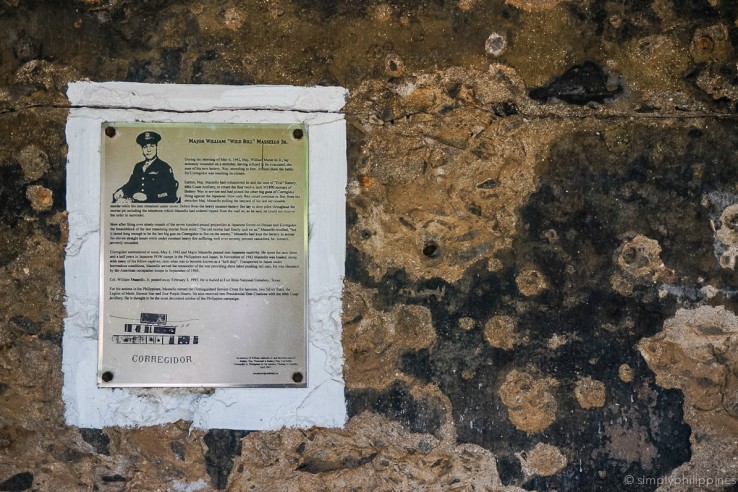
The height and width of the screenshot is (492, 738). In order to click on white edge of the poster in this screenshot , I will do `click(334, 233)`.